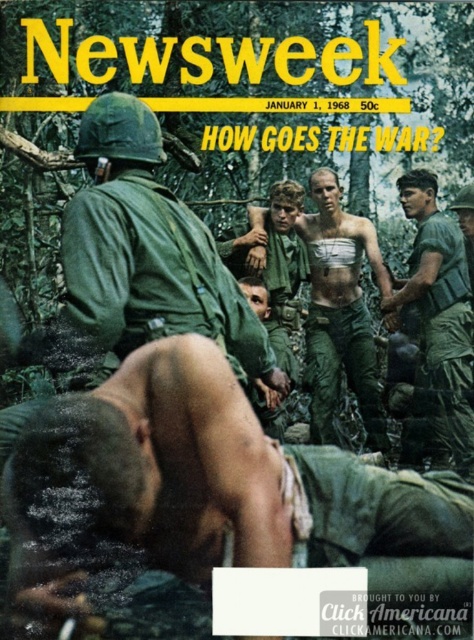
Question: Is skinny man at center above camouflage uniform at center?

Choices:
 (A) yes
 (B) no

Answer: (A)

Question: Which object is farther from the camera taking this photo?

Choices:
 (A) green matte helmet at upper left
 (B) skinny man at center
 (C) camouflage uniform at center

Answer: (B)

Question: Which object is positioned closest to the skinny man at center?

Choices:
 (A) green matte helmet at upper left
 (B) matte green uniform at center

Answer: (A)

Question: Which point appears closest to the camera in this image?

Choices:
 (A) (419, 202)
 (B) (111, 113)
 (C) (313, 182)

Answer: (B)

Question: Is green matte helmet at upper left thinner than skinny man at center?

Choices:
 (A) yes
 (B) no

Answer: (B)

Question: Can you confirm if matte green uniform at center is positioned below camouflage uniform at center?

Choices:
 (A) yes
 (B) no

Answer: (A)